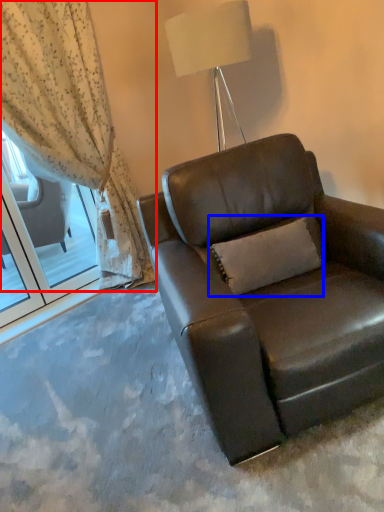
Question: Which of the following is the farthest to the observer, curtain (highlighted by a red box) or pillow (highlighted by a blue box)?

Choices:
 (A) curtain
 (B) pillow

Answer: (A)